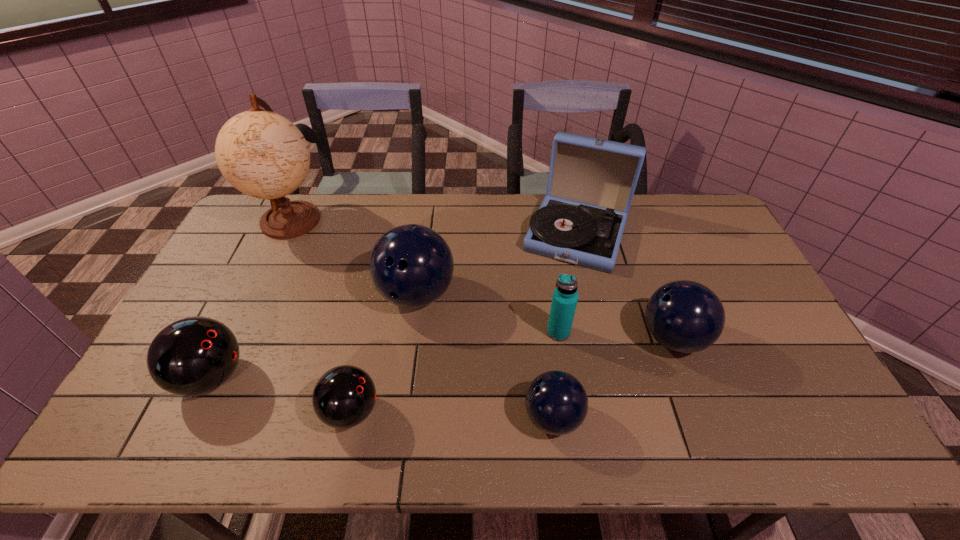
Locate an element on the screen. empty space between the smallest blue bowling ball and the leftmost bowling ball is located at coordinates (382, 397).

The height and width of the screenshot is (540, 960). In order to click on free space that is in between the biggest blue bowling ball and the seventh shortest object in this screenshot , I will do `click(496, 264)`.

You are a GUI agent. You are given a task and a screenshot of the screen. Output one action in this format:
    pyautogui.click(x=<x>, y=<y>)
    Task: Click on the free point between the smaller black bowling ball and the beige globe
    The height and width of the screenshot is (540, 960).
    Given the screenshot: What is the action you would take?
    pyautogui.click(x=322, y=315)

You are a GUI agent. You are given a task and a screenshot of the screen. Output one action in this format:
    pyautogui.click(x=<x>, y=<y>)
    Task: Click on the object that is the nearest to the second biggest blue bowling ball
    This screenshot has height=540, width=960.
    Given the screenshot: What is the action you would take?
    pyautogui.click(x=591, y=183)

Locate which object is the fourth closest to the tallest object. Please provide its 2D coordinates. Your answer should be formatted as a tuple, i.e. [(x, y)], where the tuple contains the x and y coordinates of a point satisfying the conditions above.

[(591, 183)]

Where is `the fourth closest bowling ball to the smallest blue bowling ball`? the fourth closest bowling ball to the smallest blue bowling ball is located at coordinates (192, 356).

Point out which bowling ball is positioned as the fourth nearest to the blue water bottle. Please provide its 2D coordinates. Your answer should be formatted as a tuple, i.e. [(x, y)], where the tuple contains the x and y coordinates of a point satisfying the conditions above.

[(344, 396)]

Where is `blue bowling ball that stands as the closest to the smallest blue bowling ball`? This screenshot has width=960, height=540. blue bowling ball that stands as the closest to the smallest blue bowling ball is located at coordinates (685, 316).

Locate an element on the screen. This screenshot has width=960, height=540. the closest blue bowling ball to the right black bowling ball is located at coordinates (411, 265).

Locate an element on the screen. This screenshot has height=540, width=960. vacant area in the image that satisfies the following two spatial constraints: 1. on the surface of the leftmost blue bowling ball near the finger holes; 2. on the surface of the smaller black bowling ball near the finger holes is located at coordinates (400, 411).